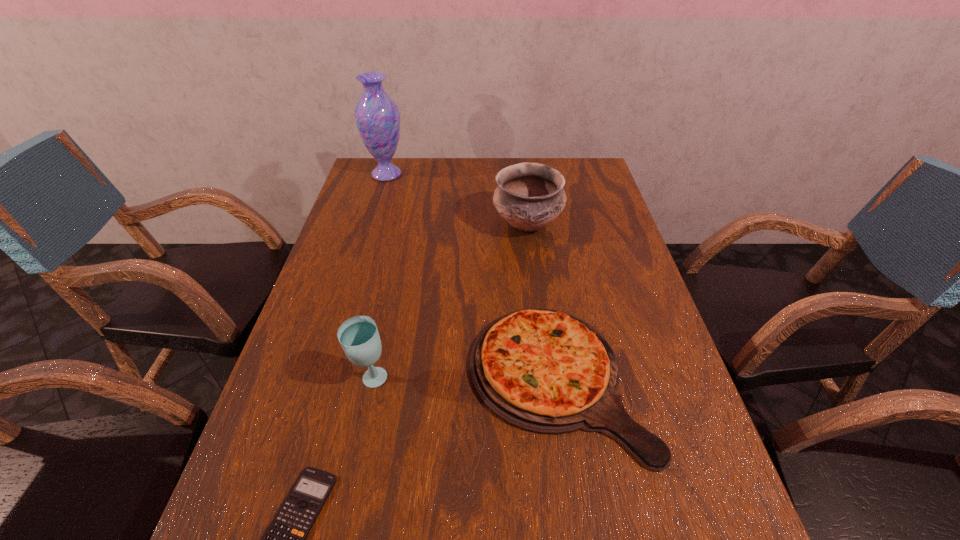
Locate an element on the screen. The height and width of the screenshot is (540, 960). vacant area that lies between the second farthest object and the fourth tallest object is located at coordinates (542, 302).

At what (x,y) coordinates should I click in order to perform the action: click on unoccupied position between the glass and the pottery. Please return your answer as a coordinate pair (x, y). The image size is (960, 540). Looking at the image, I should click on coord(449,302).

Locate an element on the screen. This screenshot has width=960, height=540. vacant space in between the glass and the pizza is located at coordinates (465, 380).

Where is `vacant area that lies between the pottery and the glass`? The height and width of the screenshot is (540, 960). vacant area that lies between the pottery and the glass is located at coordinates (449, 302).

I want to click on free point between the tallest object and the pizza, so point(472,277).

Where is `object that stands as the second closest to the shortest object`? Image resolution: width=960 pixels, height=540 pixels. object that stands as the second closest to the shortest object is located at coordinates (545, 371).

Identify which object is located as the second nearest to the calculator. Please provide its 2D coordinates. Your answer should be formatted as a tuple, i.e. [(x, y)], where the tuple contains the x and y coordinates of a point satisfying the conditions above.

[(545, 371)]

Locate an element on the screen. The image size is (960, 540). vacant area that satisfies the following two spatial constraints: 1. on the front side of the pizza; 2. on the right side of the glass is located at coordinates (371, 380).